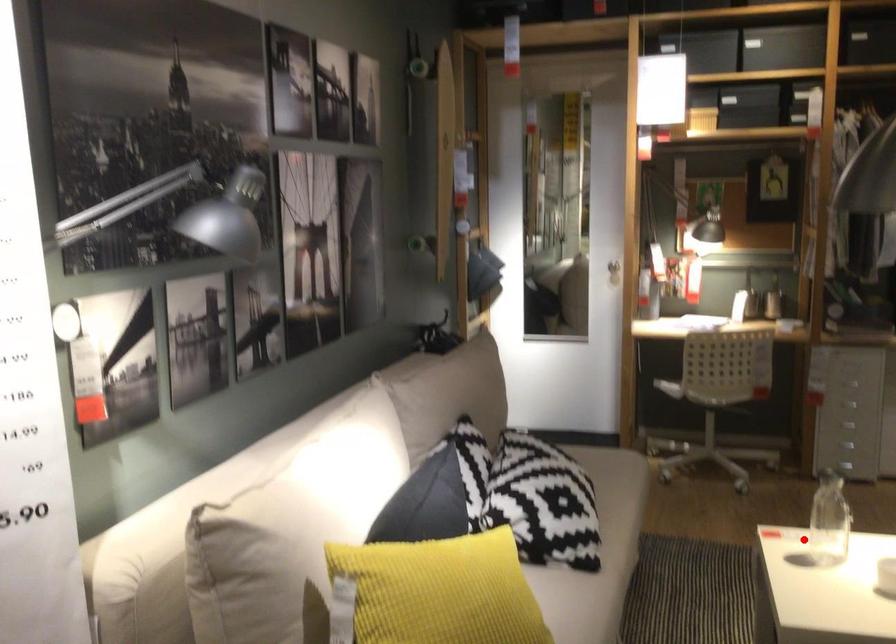
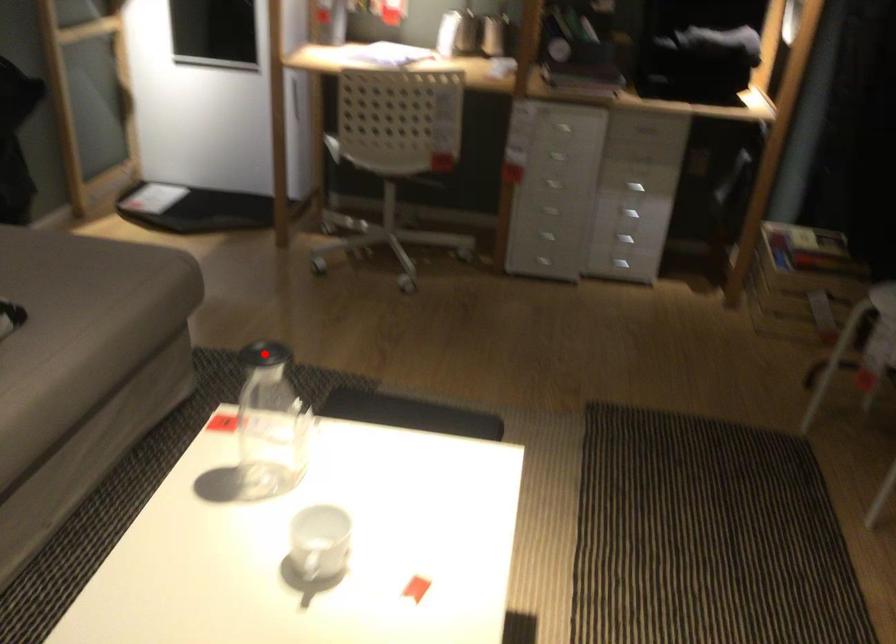
I am providing you with two images of the same scene from different viewpoints. A red point is marked on the first image and another point is marked on the second image. Are the points marked in image1 and image2 representing the same 3D position?

No